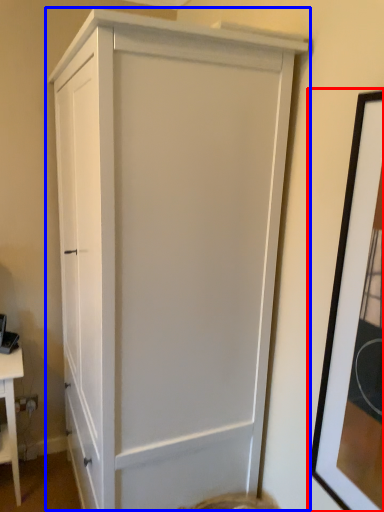
Question: Among these objects, which one is nearest to the camera, picture frame (highlighted by a red box) or cupboard (highlighted by a blue box)?

Choices:
 (A) picture frame
 (B) cupboard

Answer: (A)